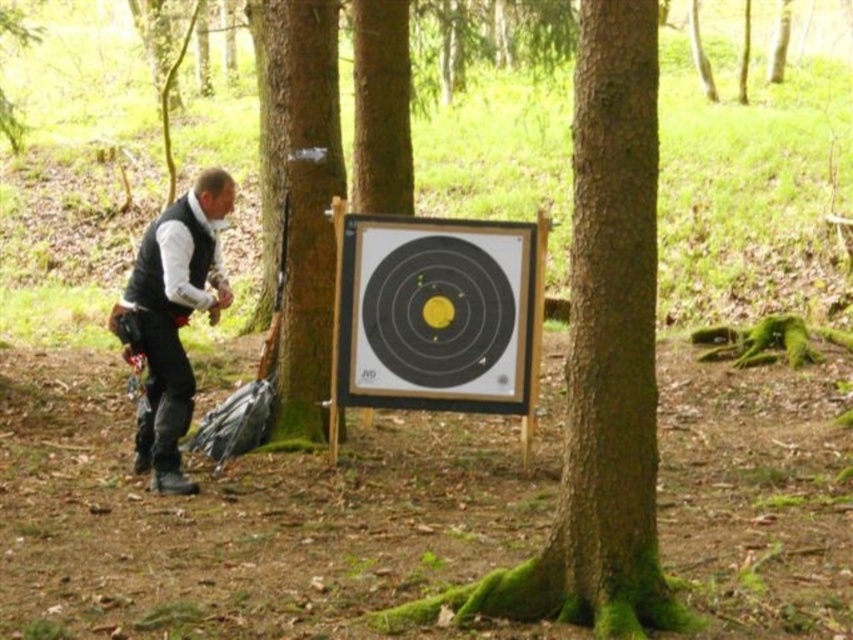
Is point (631, 348) farther from viewer compared to point (186, 291)?

No, (631, 348) is in front of (186, 291).

Measure the distance between green mossy tree at center and camera.

green mossy tree at center and camera are 4.21 meters apart from each other.

The image size is (853, 640). Identify the location of green mossy tree at center. (601, 362).